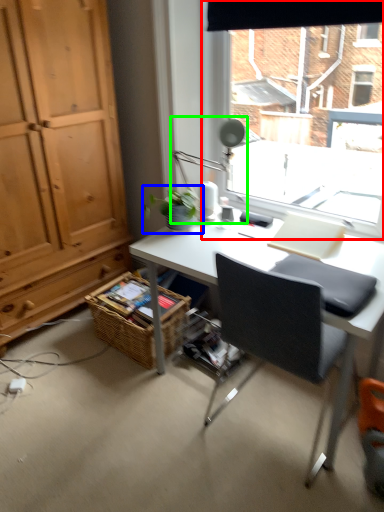
Question: Estimate the real-world distances between objects in this image. Which object is closer to window (highlighted by a red box), houseplant (highlighted by a blue box) or table lamp (highlighted by a green box)?

Choices:
 (A) houseplant
 (B) table lamp

Answer: (B)